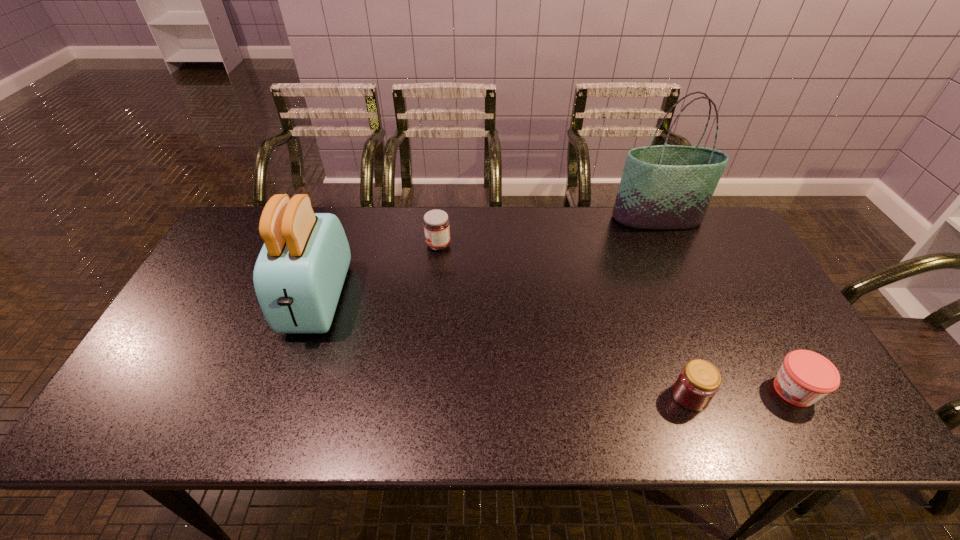
Locate an element on the screen. Image resolution: width=960 pixels, height=540 pixels. free space that satisfies the following two spatial constraints: 1. on the back side of the tallest object; 2. on the right side of the second jam from left to right is located at coordinates (624, 219).